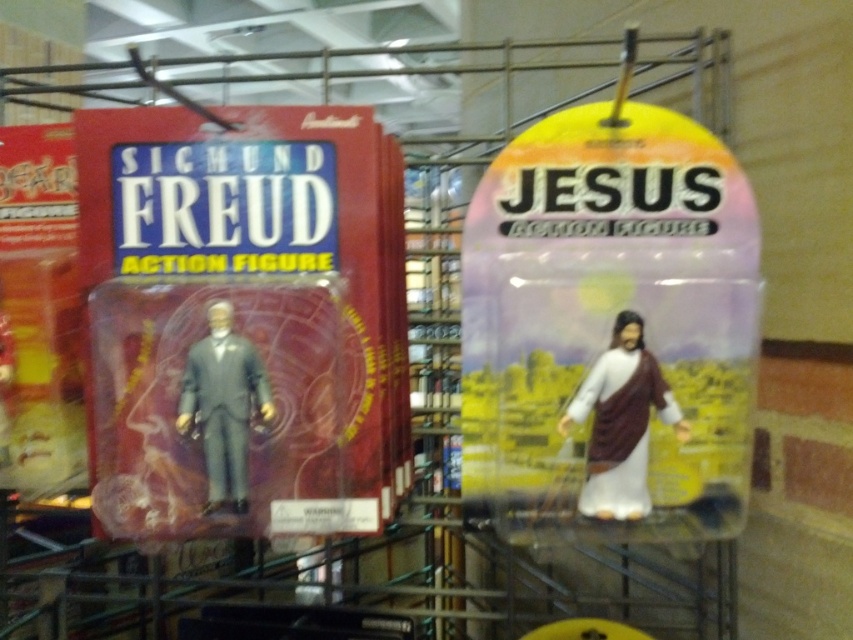
Is point (642, 460) closer to camera compared to point (252, 365)?

That is False.

Can you confirm if white matte jesus action figure at right is taller than matte gray suit at left?

No, white matte jesus action figure at right is not taller than matte gray suit at left.

Locate an element on the screen. This screenshot has height=640, width=853. white matte jesus action figure at right is located at coordinates (621, 422).